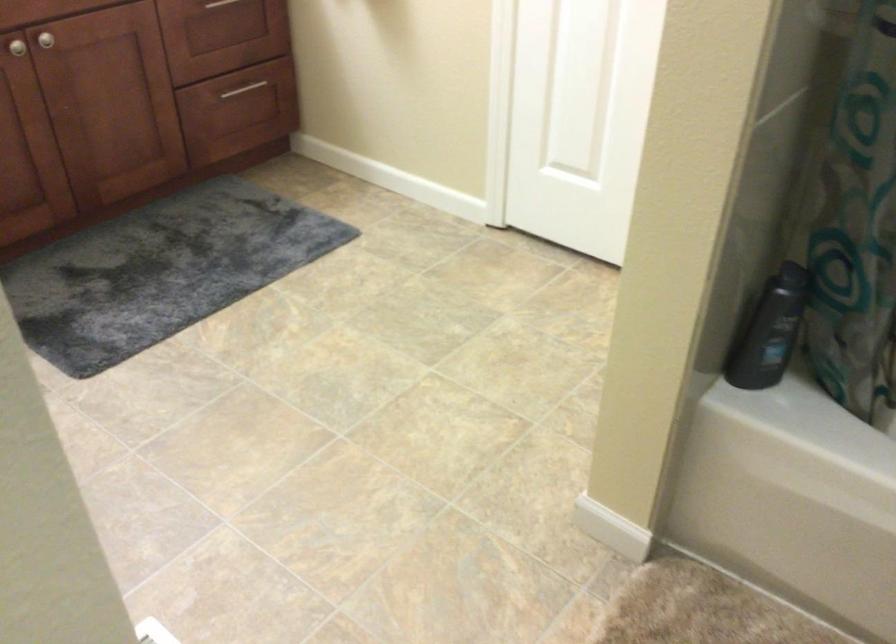
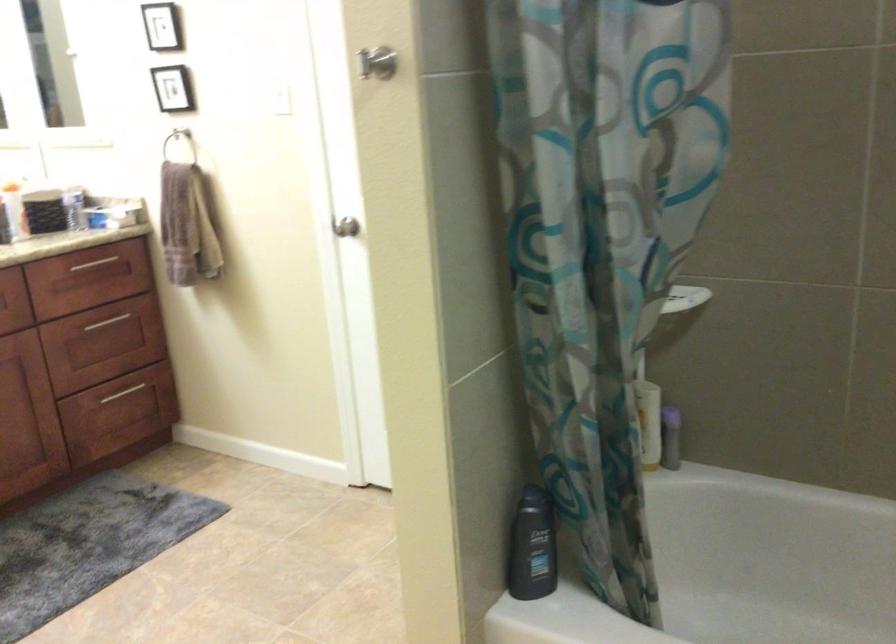
Find the pixel in the second image that matches (x=247, y=95) in the first image.

(122, 393)